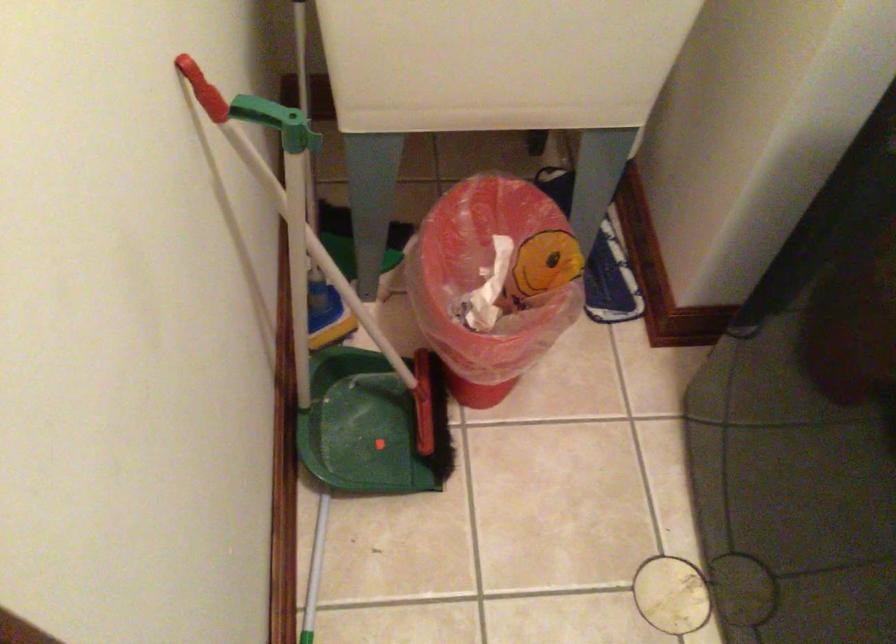
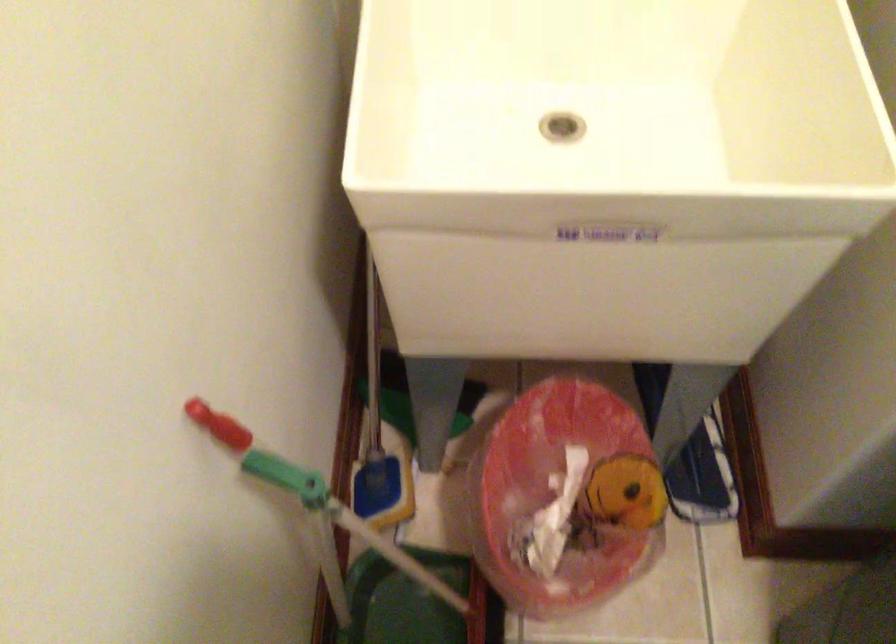
Question: The camera is either moving clockwise (left) or counter-clockwise (right) around the object. The first image is from the beginning of the video and the second image is from the end. Is the camera moving left or right when shooting the video?

Choices:
 (A) Left
 (B) Right

Answer: (B)